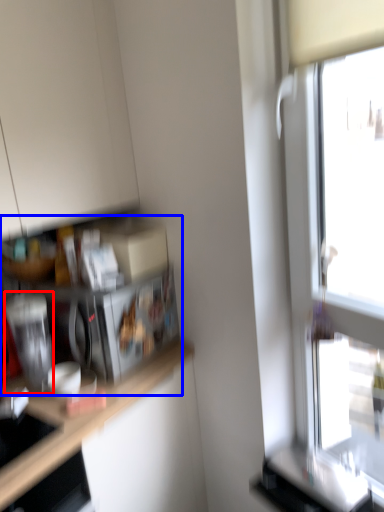
Question: Which point is further to the camera, appliance (highlighted by a red box) or shelf (highlighted by a blue box)?

Choices:
 (A) appliance
 (B) shelf

Answer: (B)